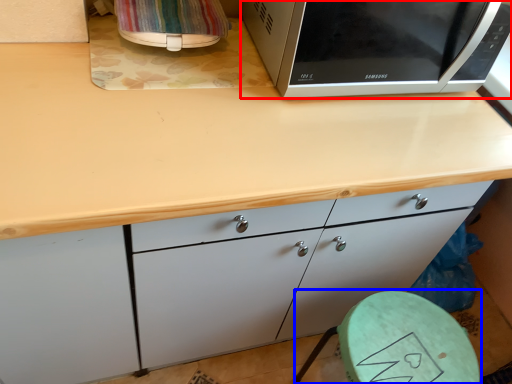
Question: Which object is closer to the camera taking this photo, microwave oven (highlighted by a red box) or round table (highlighted by a blue box)?

Choices:
 (A) microwave oven
 (B) round table

Answer: (A)